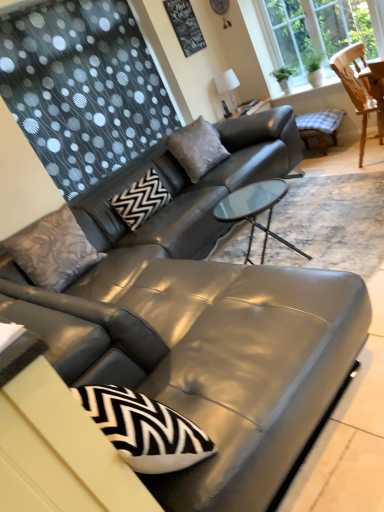
Question: From a real-world perspective, does transparent glass window at upper right sit lower than wooden chair at upper right?

Choices:
 (A) yes
 (B) no

Answer: (B)

Question: Considering the relative sizes of transparent glass window at upper right and wooden chair at upper right in the image provided, is transparent glass window at upper right shorter than wooden chair at upper right?

Choices:
 (A) yes
 (B) no

Answer: (B)

Question: Is transparent glass window at upper right not near wooden chair at upper right?

Choices:
 (A) no
 (B) yes

Answer: (A)

Question: Is transparent glass window at upper right oriented away from wooden chair at upper right?

Choices:
 (A) no
 (B) yes

Answer: (A)

Question: Is transparent glass window at upper right thinner than wooden chair at upper right?

Choices:
 (A) no
 (B) yes

Answer: (B)

Question: Does transparent glass window at upper right appear on the right side of wooden chair at upper right?

Choices:
 (A) no
 (B) yes

Answer: (A)

Question: Is black textured board at upper center oriented towards black zigzag-patterned pillow at center, which appears as the 2th pillow when viewed from the right?

Choices:
 (A) no
 (B) yes

Answer: (A)

Question: From the image's perspective, does black textured board at upper center appear lower than black zigzag-patterned pillow at center, which appears as the 2th pillow when viewed from the right?

Choices:
 (A) no
 (B) yes

Answer: (A)

Question: Does black textured board at upper center have a greater height compared to black zigzag-patterned pillow at center, which appears as the 2th pillow when viewed from the right?

Choices:
 (A) yes
 (B) no

Answer: (A)

Question: Is black textured board at upper center outside of black zigzag-patterned pillow at center, which appears as the 2th pillow when viewed from the right?

Choices:
 (A) yes
 (B) no

Answer: (A)

Question: Is black textured board at upper center looking in the opposite direction of black zigzag-patterned pillow at center, which appears as the 2th pillow when viewed from the right?

Choices:
 (A) no
 (B) yes

Answer: (A)

Question: Considering the relative positions of black textured board at upper center and black zigzag-patterned pillow at center, the second pillow from the left, in the image provided, is black textured board at upper center behind black zigzag-patterned pillow at center, the second pillow from the left,?

Choices:
 (A) no
 (B) yes

Answer: (B)

Question: From a real-world perspective, is textured gray pillow at left, the 1th pillow from the left, under transparent glass window at upper right?

Choices:
 (A) yes
 (B) no

Answer: (A)